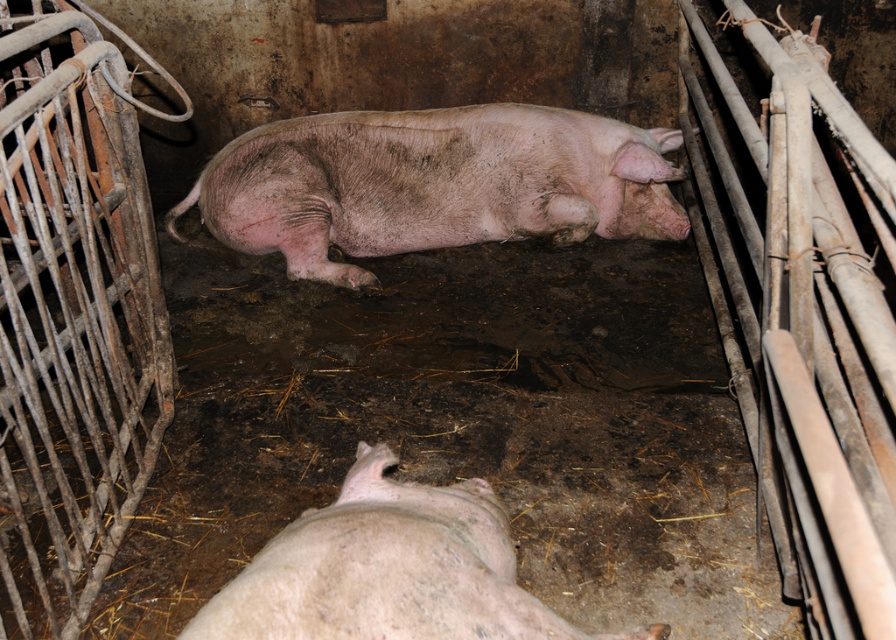
Question: Which point is farther to the camera?

Choices:
 (A) (604, 166)
 (B) (366, 593)

Answer: (A)

Question: Is pink matte pig at center above pink matte pig at lower center?

Choices:
 (A) yes
 (B) no

Answer: (A)

Question: Which object appears closest to the camera in this image?

Choices:
 (A) pink matte pig at center
 (B) pink matte pig at lower center

Answer: (B)

Question: Is pink matte pig at center thinner than pink matte pig at lower center?

Choices:
 (A) yes
 (B) no

Answer: (B)

Question: Can you confirm if pink matte pig at center is thinner than pink matte pig at lower center?

Choices:
 (A) no
 (B) yes

Answer: (A)